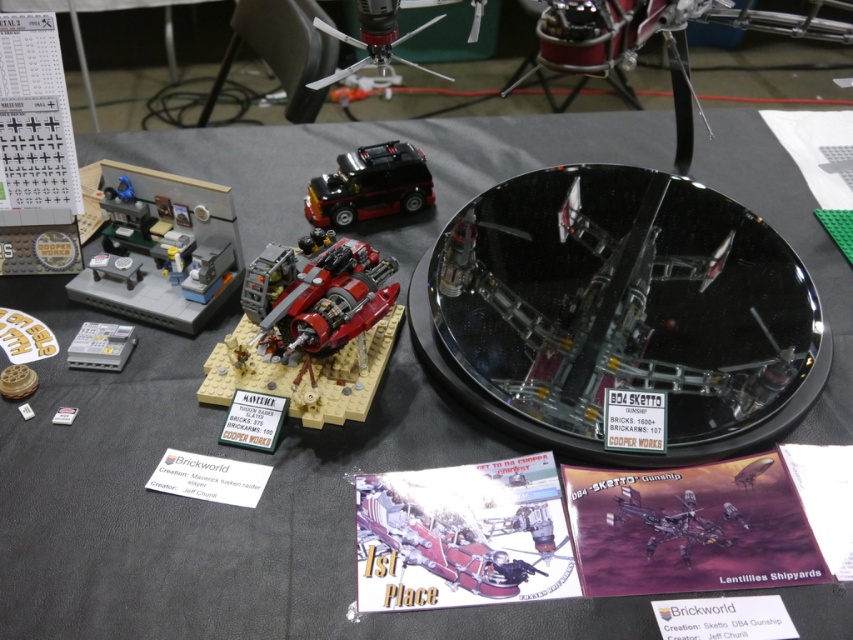
Can you confirm if matte black vehicle at center is smaller than shiny red plastic spaceship at center?

No, matte black vehicle at center is not smaller than shiny red plastic spaceship at center.

Measure the distance between point (x=308, y=397) and camera.

They are 35.95 inches apart.

What do you see at coordinates (310, 330) in the screenshot? The image size is (853, 640). I see `matte black vehicle at center` at bounding box center [310, 330].

Locate an element on the screen. The height and width of the screenshot is (640, 853). matte black vehicle at center is located at coordinates (310, 330).

Is matte gray plastic office desk at upper left smaller than matte black car at center?

Actually, matte gray plastic office desk at upper left might be larger than matte black car at center.

Between matte gray plastic office desk at upper left and matte black car at center, which one is positioned higher?

matte black car at center is higher up.

Does point (206, 262) come closer to viewer compared to point (376, 172)?

Yes, it is.

Locate an element on the screen. This screenshot has width=853, height=640. matte gray plastic office desk at upper left is located at coordinates (163, 248).

Which is more to the right, matte black vehicle at center or metallic silver gunship at center?

metallic silver gunship at center

Is matte black vehicle at center bigger than metallic silver gunship at center?

Yes.

Does point (383, 314) come farther from viewer compared to point (665, 532)?

Yes, point (383, 314) is behind point (665, 532).

This screenshot has height=640, width=853. What are the coordinates of `matte black vehicle at center` in the screenshot? It's located at (310, 330).